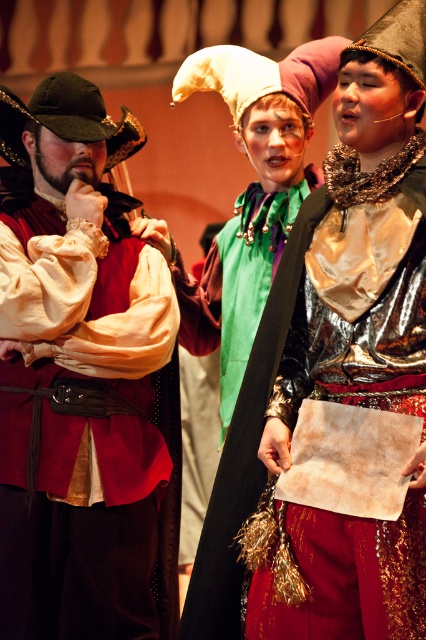
You are a stagehand preparing to move props during a play. You need to place a 3.5 feet long pole between the matte red vest at left and the metallic gold dress at center. Will the pole fit without touching either prop?

The distance between the matte red vest at left and the metallic gold dress at center is 3.51 feet. Since the pole is 3.5 feet long, it will fit with a small gap of 0.01 feet remaining. Therefore, the pole can be placed between them without touching either prop.

You are an actor in a play and need to exit the stage through a door located behind the metallic gold dress at center. Can you move around the matte red vest at left to reach the door?

The metallic gold dress at center is behind the matte red vest at left, so you can move around the matte red vest at left to access the door behind the metallic gold dress at center.

You are an assistant helping to prepare for a costume fitting. You have two costumes to consider for a character who needs to wear a smaller outfit. Which costume should you choose between the matte red vest at left and the metallic gold dress at center?

The metallic gold dress at center is smaller than the matte red vest at left, so you should choose the metallic gold dress at center for the character who needs a smaller outfit.